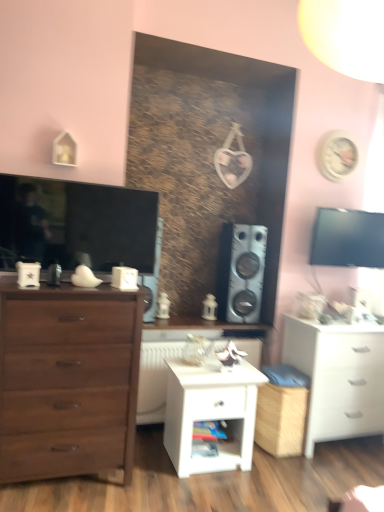
Question: From a real-world perspective, is wooden shelf at center positioned over white plastic radiator at center based on gravity?

Choices:
 (A) yes
 (B) no

Answer: (B)

Question: Does wooden shelf at center appear on the right side of white plastic radiator at center?

Choices:
 (A) no
 (B) yes

Answer: (B)

Question: From the image's perspective, would you say wooden shelf at center is positioned over white plastic radiator at center?

Choices:
 (A) no
 (B) yes

Answer: (A)

Question: Can you confirm if wooden shelf at center is positioned to the left of white plastic radiator at center?

Choices:
 (A) yes
 (B) no

Answer: (B)

Question: Does wooden shelf at center have a lesser width compared to white plastic radiator at center?

Choices:
 (A) yes
 (B) no

Answer: (A)

Question: From a real-world perspective, is black glossy tv at upper right physically located above or below white plastic radiator at center?

Choices:
 (A) above
 (B) below

Answer: (A)

Question: In terms of width, does black glossy tv at upper right look wider or thinner when compared to white plastic radiator at center?

Choices:
 (A) thin
 (B) wide

Answer: (A)

Question: Which is correct: black glossy tv at upper right is inside white plastic radiator at center, or outside of it?

Choices:
 (A) outside
 (B) inside

Answer: (A)

Question: From their relative heights in the image, would you say black glossy tv at upper right is taller or shorter than white plastic radiator at center?

Choices:
 (A) short
 (B) tall

Answer: (A)

Question: Is matte brown chest of drawers at left, acting as the second chest of drawers starting from the right, taller or shorter than matte black television at left?

Choices:
 (A) short
 (B) tall

Answer: (B)

Question: From a real-world perspective, is matte brown chest of drawers at left, acting as the second chest of drawers starting from the right, positioned above or below matte black television at left?

Choices:
 (A) above
 (B) below

Answer: (B)

Question: Is matte brown chest of drawers at left, which ranks as the first chest of drawers in front-to-back order, in front of or behind matte black television at left in the image?

Choices:
 (A) behind
 (B) front

Answer: (B)

Question: From the image's perspective, is matte brown chest of drawers at left, which ranks as the 2th chest of drawers in back-to-front order, positioned above or below matte black television at left?

Choices:
 (A) below
 (B) above

Answer: (A)

Question: Is matte brown chest of drawers at left, which ranks as the first chest of drawers in front-to-back order, wider or thinner than black glossy tv at upper right?

Choices:
 (A) wide
 (B) thin

Answer: (A)

Question: Is point (137, 294) closer or farther from the camera than point (357, 227)?

Choices:
 (A) closer
 (B) farther

Answer: (A)